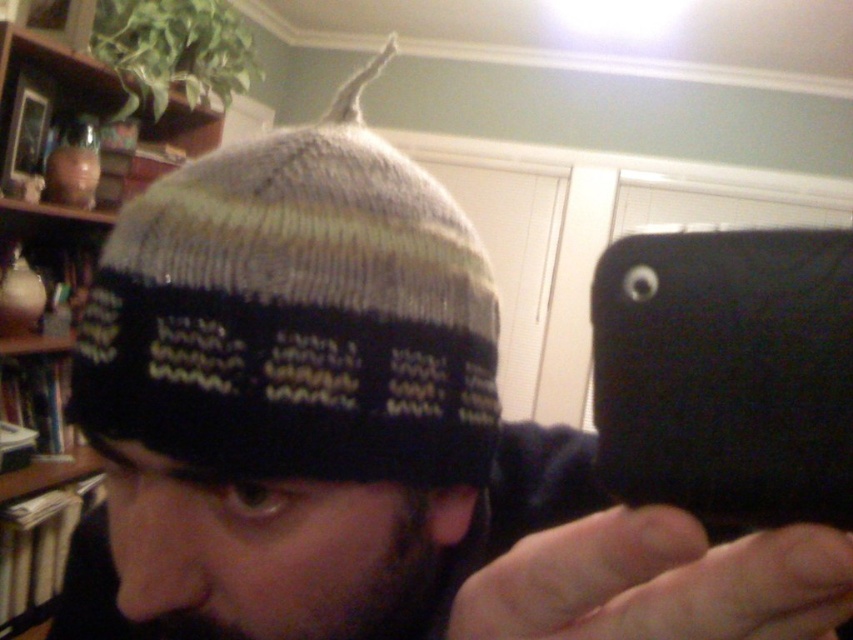
Question: Can you confirm if knitted woolen hat at center is thinner than matte brown vase at upper left?

Choices:
 (A) yes
 (B) no

Answer: (A)

Question: Can you confirm if knitted woolen hat at center is positioned above matte brown vase at upper left?

Choices:
 (A) yes
 (B) no

Answer: (A)

Question: Is knitted woolen hat at center bigger than matte brown vase at upper left?

Choices:
 (A) yes
 (B) no

Answer: (B)

Question: Among these objects, which one is farthest from the camera?

Choices:
 (A) matte brown vase at upper left
 (B) knitted woolen hat at center

Answer: (A)